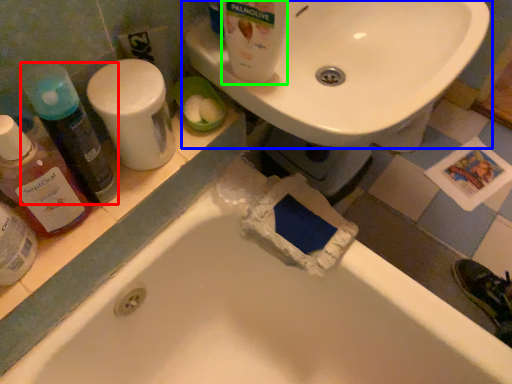
Question: Based on their relative distances, which object is nearer to cleaning product (highlighted by a red box)? Choose from sink (highlighted by a blue box) and cleaning product (highlighted by a green box).

Choices:
 (A) sink
 (B) cleaning product

Answer: (B)